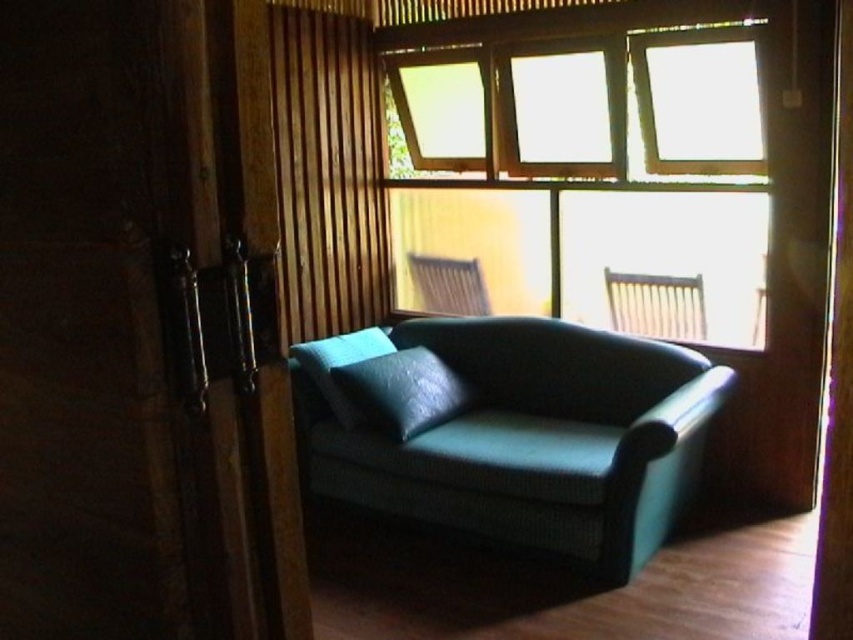
Between transparent glass window at upper center and teal leather pillow at center, which one is positioned higher?

transparent glass window at upper center

Between transparent glass window at upper center and teal leather pillow at center, which one appears on the right side from the viewer's perspective?

From the viewer's perspective, transparent glass window at upper center appears more on the right side.

Who is more forward, (689, 109) or (425, 422)?

Point (425, 422) is in front.

Identify the location of transparent glass window at upper center. The image size is (853, 640). (680, 184).

Can you confirm if green fabric curtain at center is wider than teal fabric armchair at center?

Correct, the width of green fabric curtain at center exceeds that of teal fabric armchair at center.

At what (x,y) coordinates should I click in order to perform the action: click on green fabric curtain at center. Please return your answer as a coordinate pair (x, y). Image resolution: width=853 pixels, height=640 pixels. Looking at the image, I should click on (328, 172).

Locate an element on the screen. green fabric curtain at center is located at coordinates (328, 172).

Identify the location of green fabric curtain at center. Image resolution: width=853 pixels, height=640 pixels. (328, 172).

Can you confirm if transparent glass window at upper center is thinner than teal leather armchair at center?

Incorrect, transparent glass window at upper center's width is not less than teal leather armchair at center's.

Between point (698, 260) and point (660, 276), which one is positioned behind?

The point (660, 276) is more distant.

In the scene shown: Who is more forward, (x=741, y=173) or (x=618, y=275)?

Positioned in front is point (x=741, y=173).

Image resolution: width=853 pixels, height=640 pixels. I want to click on transparent glass window at upper center, so click(x=680, y=184).